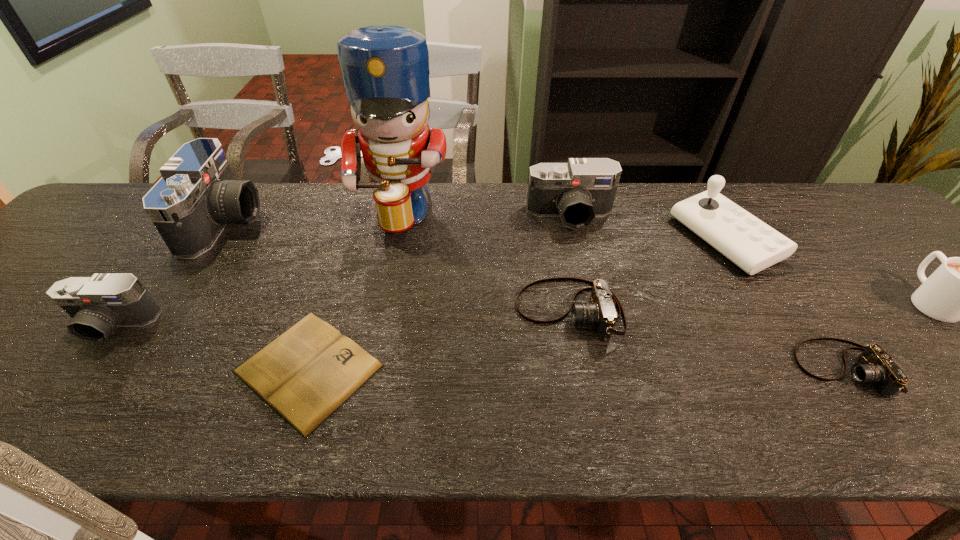
The image size is (960, 540). In order to click on vacant space that is in between the shortest camera and the eighth shortest object in this screenshot , I will do 535,295.

Identify the location of object that is the eighth closest to the nearest black camera. Image resolution: width=960 pixels, height=540 pixels. (959, 289).

Identify which object is located as the sixth nearest to the third tallest camera. Please provide its 2D coordinates. Your answer should be formatted as a tuple, i.e. [(x, y)], where the tuple contains the x and y coordinates of a point satisfying the conditions above.

[(752, 245)]

You are a GUI agent. You are given a task and a screenshot of the screen. Output one action in this format:
    pyautogui.click(x=<x>, y=<y>)
    Task: Click on the camera object that ranks as the second closest to the nutcracker
    
    Given the screenshot: What is the action you would take?
    pyautogui.click(x=600, y=311)

Identify the location of camera that can be found as the third closest to the joystick. pos(600,311).

This screenshot has width=960, height=540. I want to click on black camera that is the closest one to the rightmost object, so click(578, 191).

The width and height of the screenshot is (960, 540). What are the coordinates of `black camera that is the second closest to the third tallest camera` in the screenshot? It's located at (578, 191).

Image resolution: width=960 pixels, height=540 pixels. Find the location of `free region that satisfies the following two spatial constraints: 1. on the front-facing side of the nearest black camera; 2. on the right side of the shortest object`. free region that satisfies the following two spatial constraints: 1. on the front-facing side of the nearest black camera; 2. on the right side of the shortest object is located at coordinates (80, 368).

You are a GUI agent. You are given a task and a screenshot of the screen. Output one action in this format:
    pyautogui.click(x=<x>, y=<y>)
    Task: Click on the free space that satisfies the following two spatial constraints: 1. on the front-facing side of the second tallest object; 2. on the front-facing side of the smallest black camera
    Image resolution: width=960 pixels, height=540 pixels.
    Given the screenshot: What is the action you would take?
    pyautogui.click(x=158, y=325)

Locate an element on the screen. blank area in the image that satisfies the following two spatial constraints: 1. on the front-facing side of the left brown camera; 2. on the front-facing side of the smallest black camera is located at coordinates (572, 325).